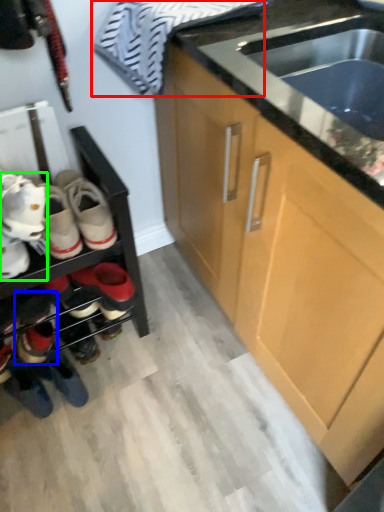
Question: Which object is the closest to the laundry (highlighted by a red box)? Choose among these: footwear (highlighted by a blue box) or footwear (highlighted by a green box).

Choices:
 (A) footwear
 (B) footwear

Answer: (B)